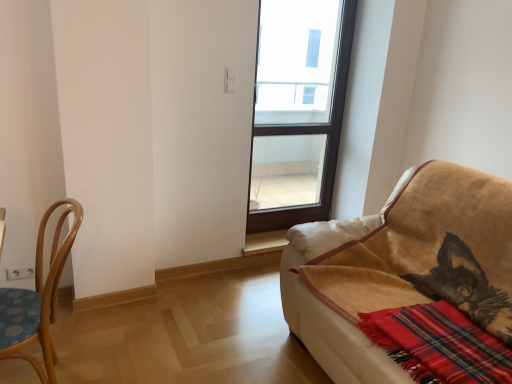
Question: Considering the relative positions of red plaid blanket at lower right and light brown wood chair at left in the image provided, is red plaid blanket at lower right to the left of light brown wood chair at left from the viewer's perspective?

Choices:
 (A) yes
 (B) no

Answer: (B)

Question: From a real-world perspective, is red plaid blanket at lower right located higher than light brown wood chair at left?

Choices:
 (A) no
 (B) yes

Answer: (B)

Question: Considering the relative positions of red plaid blanket at lower right and light brown wood chair at left in the image provided, is red plaid blanket at lower right behind light brown wood chair at left?

Choices:
 (A) no
 (B) yes

Answer: (A)

Question: Is red plaid blanket at lower right turned away from light brown wood chair at left?

Choices:
 (A) yes
 (B) no

Answer: (B)

Question: Is red plaid blanket at lower right outside of light brown wood chair at left?

Choices:
 (A) no
 (B) yes

Answer: (B)

Question: Looking at the image, does transparent glass window at center seem bigger or smaller compared to red plaid blanket at lower right?

Choices:
 (A) small
 (B) big

Answer: (B)

Question: Is point tap(302, 66) closer or farther from the camera than point tap(501, 372)?

Choices:
 (A) closer
 (B) farther

Answer: (B)

Question: Would you say transparent glass window at center is to the left or to the right of red plaid blanket at lower right in the picture?

Choices:
 (A) left
 (B) right

Answer: (A)

Question: Considering the positions of transparent glass window at center and red plaid blanket at lower right in the image, is transparent glass window at center wider or thinner than red plaid blanket at lower right?

Choices:
 (A) wide
 (B) thin

Answer: (B)

Question: Is transparent glass window at center wider or thinner than light brown wood chair at left?

Choices:
 (A) thin
 (B) wide

Answer: (A)

Question: From a real-world perspective, relative to light brown wood chair at left, is transparent glass window at center vertically above or below?

Choices:
 (A) above
 (B) below

Answer: (A)

Question: Considering the positions of transparent glass window at center and light brown wood chair at left in the image, is transparent glass window at center bigger or smaller than light brown wood chair at left?

Choices:
 (A) small
 (B) big

Answer: (A)

Question: Relative to light brown wood chair at left, is transparent glass window at center in front or behind?

Choices:
 (A) front
 (B) behind

Answer: (B)

Question: From a real-world perspective, is red plaid blanket at lower right positioned above or below transparent glass window at center?

Choices:
 (A) below
 (B) above

Answer: (A)

Question: In terms of height, does red plaid blanket at lower right look taller or shorter compared to transparent glass window at center?

Choices:
 (A) short
 (B) tall

Answer: (A)